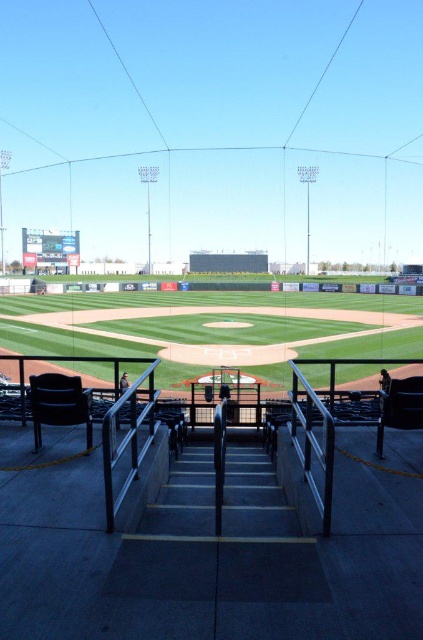
Can you confirm if green grass baseball field at center is positioned to the right of dark gray concrete stairs at center?

Incorrect, green grass baseball field at center is not on the right side of dark gray concrete stairs at center.

Does green grass baseball field at center have a smaller size compared to dark gray concrete stairs at center?

No, green grass baseball field at center is not smaller than dark gray concrete stairs at center.

Describe the element at coordinates (213, 326) in the screenshot. This screenshot has height=640, width=423. I see `green grass baseball field at center` at that location.

Identify the location of green grass baseball field at center. (213, 326).

Image resolution: width=423 pixels, height=640 pixels. Identify the location of green grass baseball field at center. (213, 326).

Between green grass baseball field at center and dark blue jersey at center, which one appears on the left side from the viewer's perspective?

Positioned to the left is green grass baseball field at center.

Where is `green grass baseball field at center`? The height and width of the screenshot is (640, 423). green grass baseball field at center is located at coordinates (213, 326).

From the picture: Is dark gray concrete stairs at center wider than dark blue jersey at center?

No.

Is dark gray concrete stairs at center above dark blue jersey at center?

No.

The height and width of the screenshot is (640, 423). Find the location of `dark gray concrete stairs at center`. dark gray concrete stairs at center is located at coordinates (253, 497).